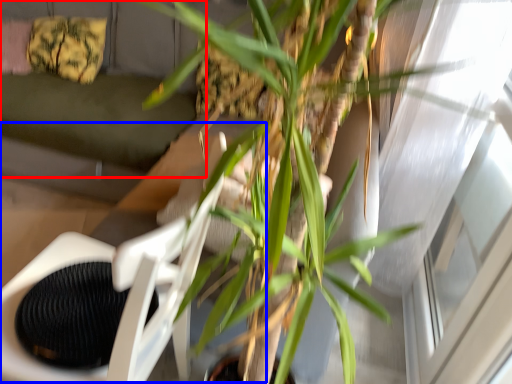
Question: Among these objects, which one is nearest to the camera, couch (highlighted by a red box) or swivel chair (highlighted by a blue box)?

Choices:
 (A) couch
 (B) swivel chair

Answer: (B)